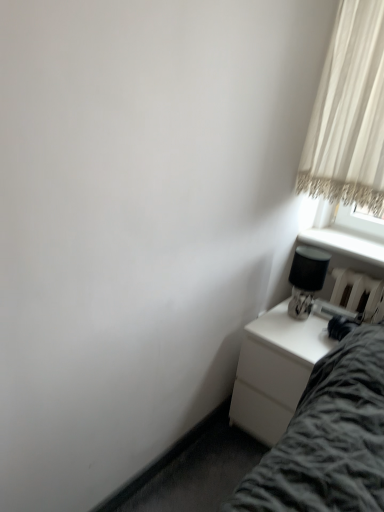
Question: From a real-world perspective, relative to black glossy table lamp at right, is white sheer curtain at upper right vertically above or below?

Choices:
 (A) below
 (B) above

Answer: (B)

Question: Is white sheer curtain at upper right in front of or behind black glossy table lamp at right in the image?

Choices:
 (A) front
 (B) behind

Answer: (A)

Question: Which is farther from the white sheer curtain at upper right?

Choices:
 (A) white glossy nightstand at lower right
 (B) black glossy table lamp at right

Answer: (A)

Question: Estimate the real-world distances between objects in this image. Which object is farther from the white sheer curtain at upper right?

Choices:
 (A) white glossy nightstand at lower right
 (B) black glossy table lamp at right

Answer: (A)